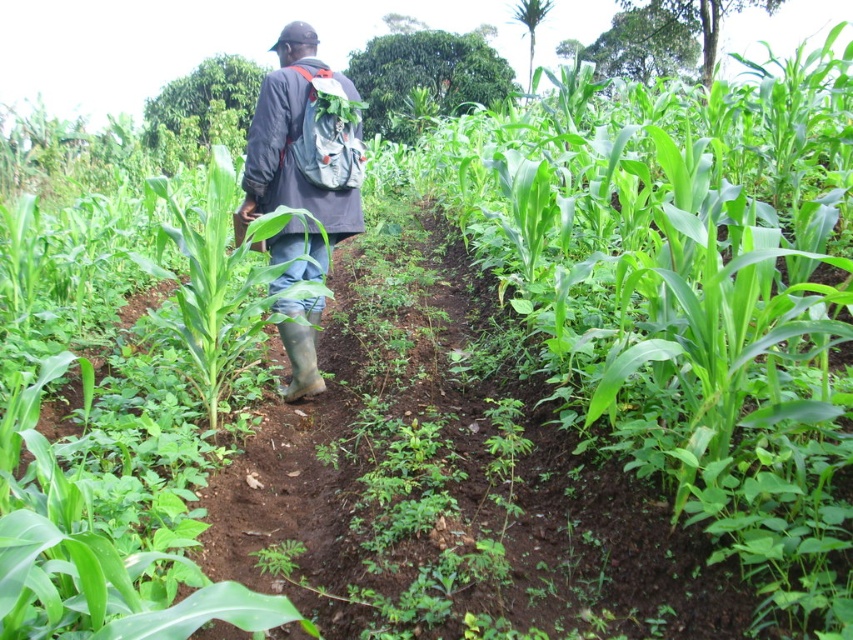
Question: Which of the following is the farthest from the observer?

Choices:
 (A) green leafy corn at center
 (B) gray fabric backpack at center

Answer: (B)

Question: Does green leafy corn at center lie behind gray fabric backpack at center?

Choices:
 (A) no
 (B) yes

Answer: (A)

Question: Which point appears farthest from the camera in this image?

Choices:
 (A) (737, 474)
 (B) (352, 220)

Answer: (B)

Question: Does green leafy corn at center have a lesser width compared to gray fabric backpack at center?

Choices:
 (A) no
 (B) yes

Answer: (A)

Question: Does green leafy corn at center appear under gray fabric backpack at center?

Choices:
 (A) no
 (B) yes

Answer: (A)